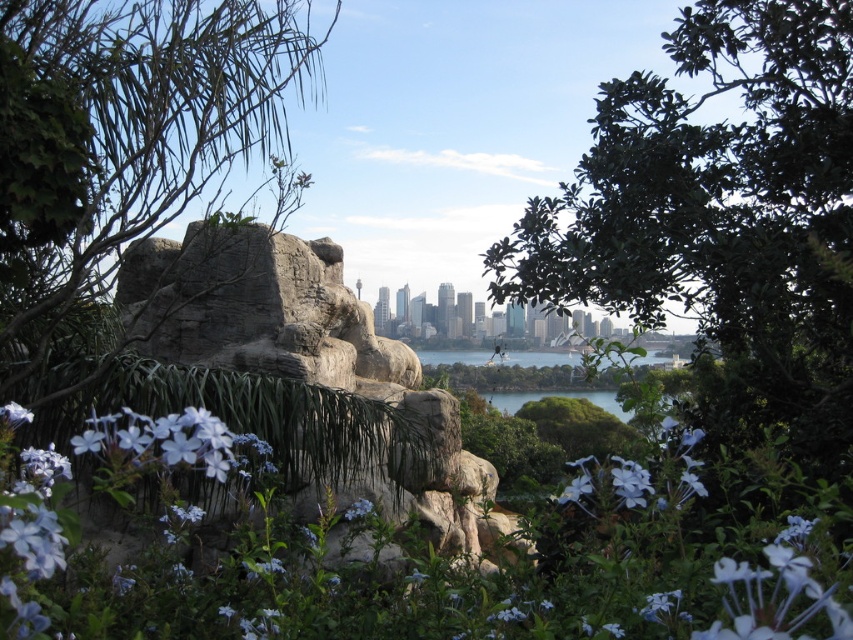
You are a gardener who wants to plant a new flower between the matte purple flower at lower left and the matte white flower at lower left. Based on their current positions, can you determine if there is enough space to plant the new flower?

The matte purple flower at lower left is positioned under the matte white flower at lower left, meaning they are stacked vertically. There is no horizontal space between them, so planting a new flower between them would not be possible.

You are a gardener who wants to plant a new flower bed between the green leafy tree at left and the matte blue flower at center. Based on their positions, which direction should you face to ensure the flower bed is placed between them?

Since the green leafy tree at left is above the matte blue flower at center, you should face downward from the tree to place the flower bed between them.

You are standing in the scenic garden described. You see two points marked in the image. The first point is at coordinate point(97, 148) and the second at point(688, 436). If you want to take a photo that captures both points clearly, which point should you focus on first to ensure both are in focus?

You should focus on point(97, 148) first because it is closer to the camera than point(688, 436). By focusing on the closer point, the farther point will also be within the depth of field, ensuring both are in focus.